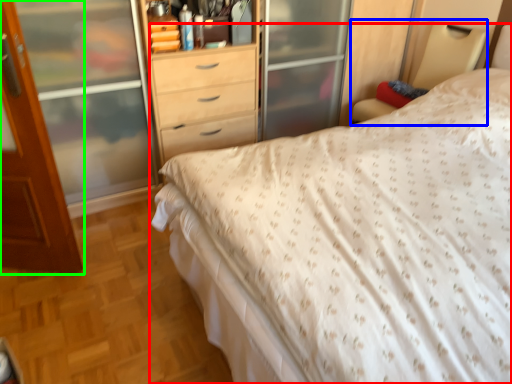
Question: Which is nearer to the bed (highlighted by a red box)? bed frame (highlighted by a blue box) or door (highlighted by a green box).

Choices:
 (A) bed frame
 (B) door

Answer: (B)